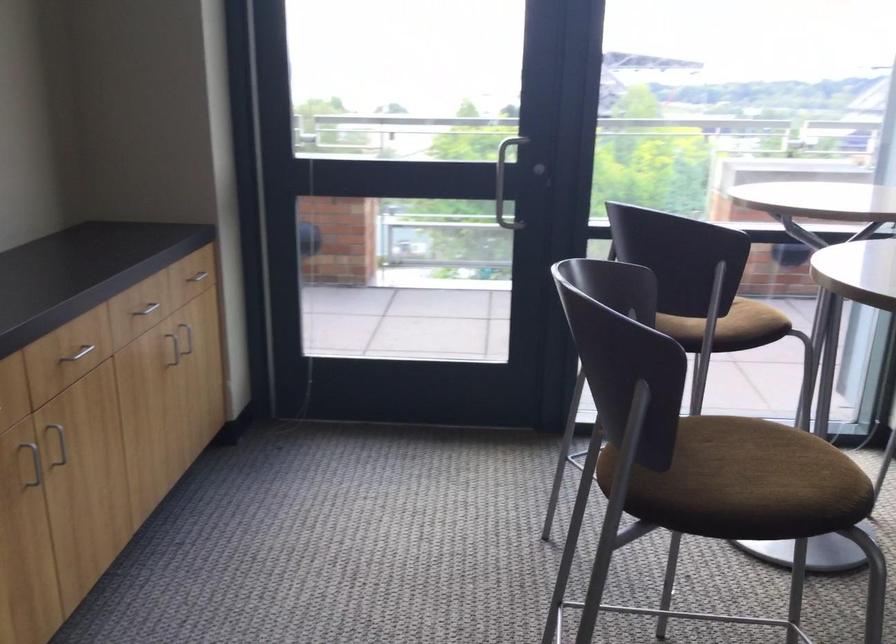
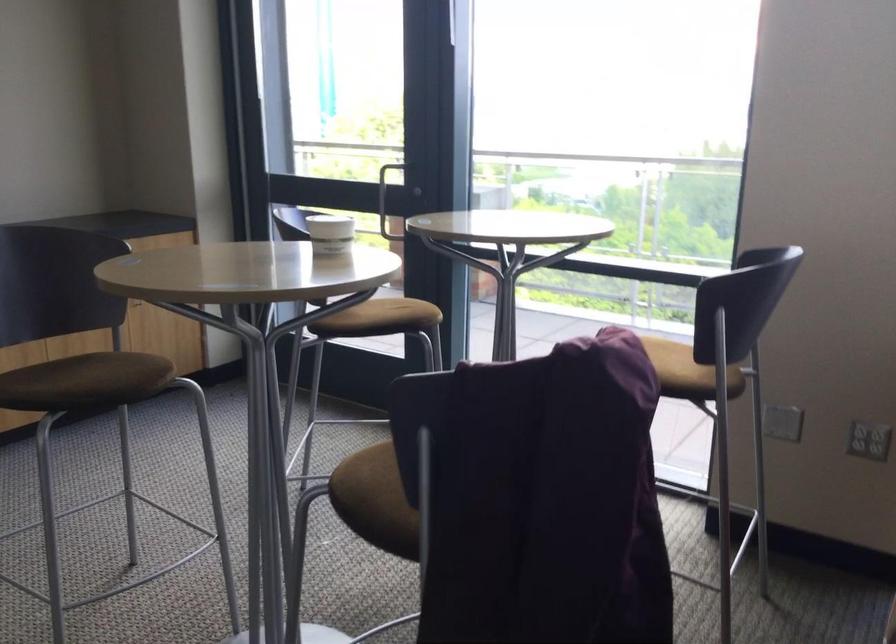
Find the pixel in the second image that matches point 92,480 in the first image.

(76, 344)